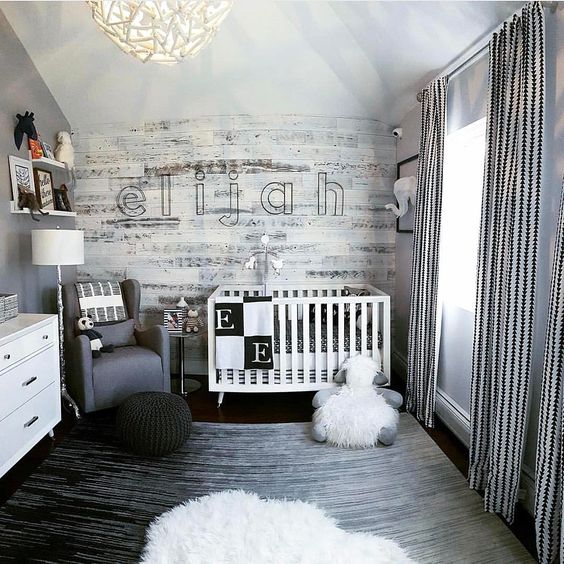
Find the location of a particular element. This screenshot has width=564, height=564. baby crib is located at coordinates (302, 371).